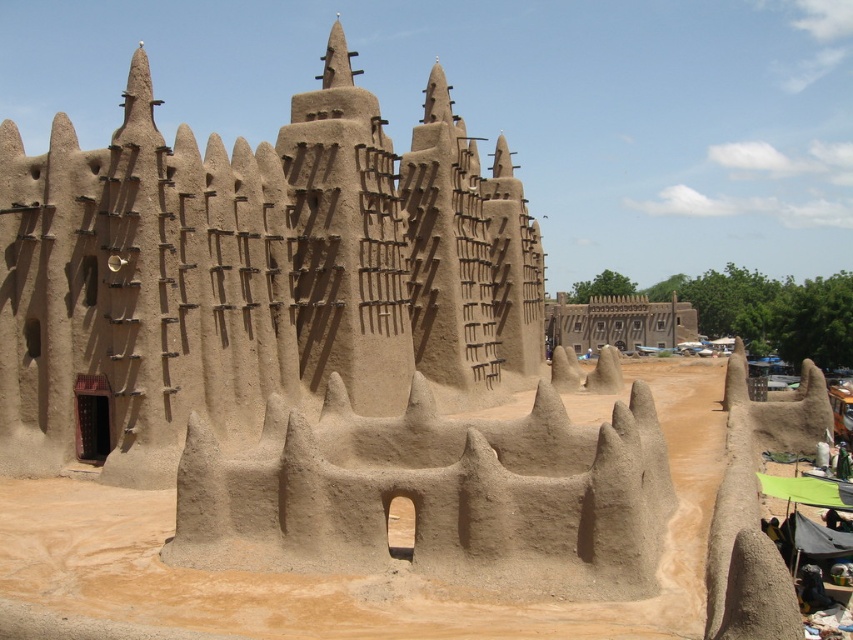
Between point (90, 172) and point (373, 589), which one is positioned behind?

Positioned behind is point (90, 172).

Does sandy beige mud at center appear on the left side of brown mud wall at center?

Yes, sandy beige mud at center is to the left of brown mud wall at center.

Locate an element on the screen. The image size is (853, 640). sandy beige mud at center is located at coordinates point(252,275).